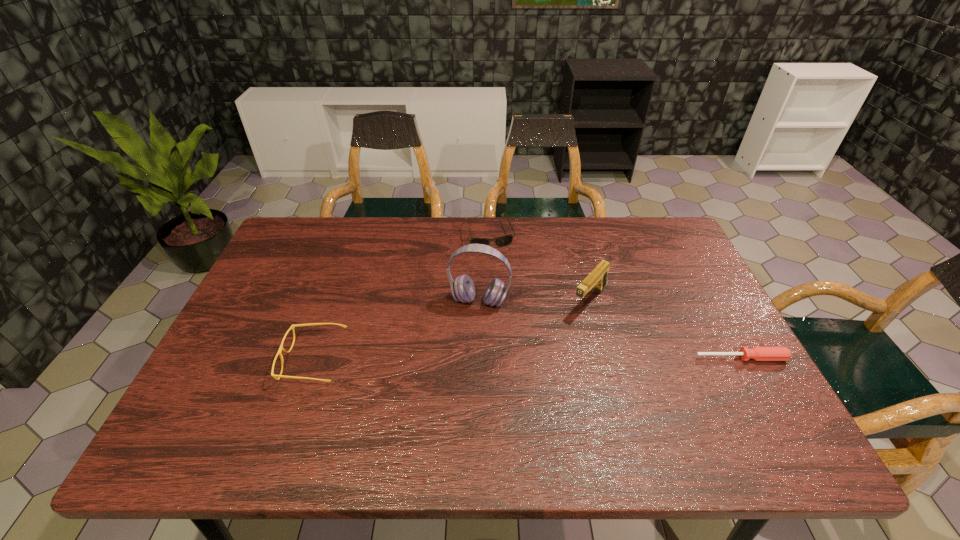
Identify the location of object that is at the near edge. (281, 348).

The width and height of the screenshot is (960, 540). I want to click on object that is at the right edge, so click(x=756, y=353).

Locate an element on the screen. This screenshot has width=960, height=540. vacant space at the far edge of the desktop is located at coordinates 540,217.

Find the location of a particular element. Image resolution: width=960 pixels, height=540 pixels. free space at the near edge of the desktop is located at coordinates (562, 391).

The height and width of the screenshot is (540, 960). In order to click on vacant space at the left edge of the desktop in this screenshot , I will do `click(274, 299)`.

The width and height of the screenshot is (960, 540). In the image, there is a desktop. In order to click on free region at the right edge in this screenshot , I will do `click(702, 368)`.

You are a GUI agent. You are given a task and a screenshot of the screen. Output one action in this format:
    pyautogui.click(x=<x>, y=<y>)
    Task: Click on the free location at the far left corner
    
    Given the screenshot: What is the action you would take?
    pyautogui.click(x=297, y=241)

In the image, there is a desktop. Where is `free space at the near left corner`? This screenshot has width=960, height=540. free space at the near left corner is located at coordinates (224, 393).

Find the location of a particular element. The width and height of the screenshot is (960, 540). vacant space at the far right corner of the desktop is located at coordinates (654, 247).

Locate an element on the screen. This screenshot has width=960, height=540. vacant point located between the screwdriver and the leftmost object is located at coordinates (527, 359).